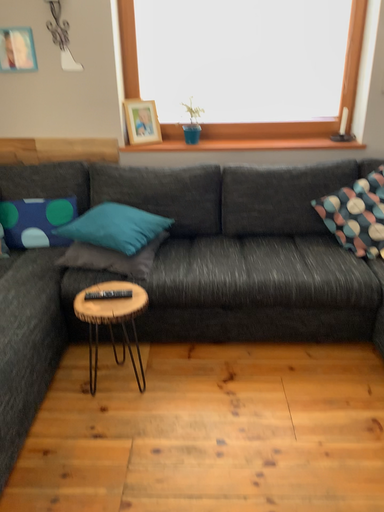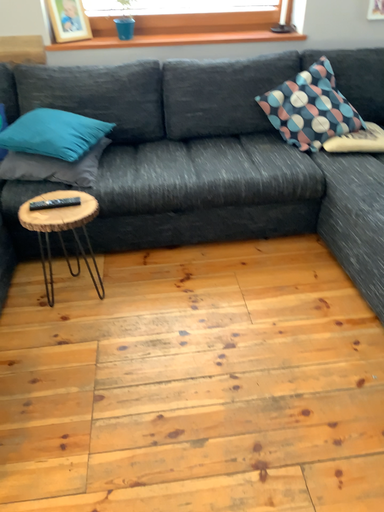
Question: Which way did the camera rotate in the video?

Choices:
 (A) rotated right
 (B) rotated left

Answer: (A)